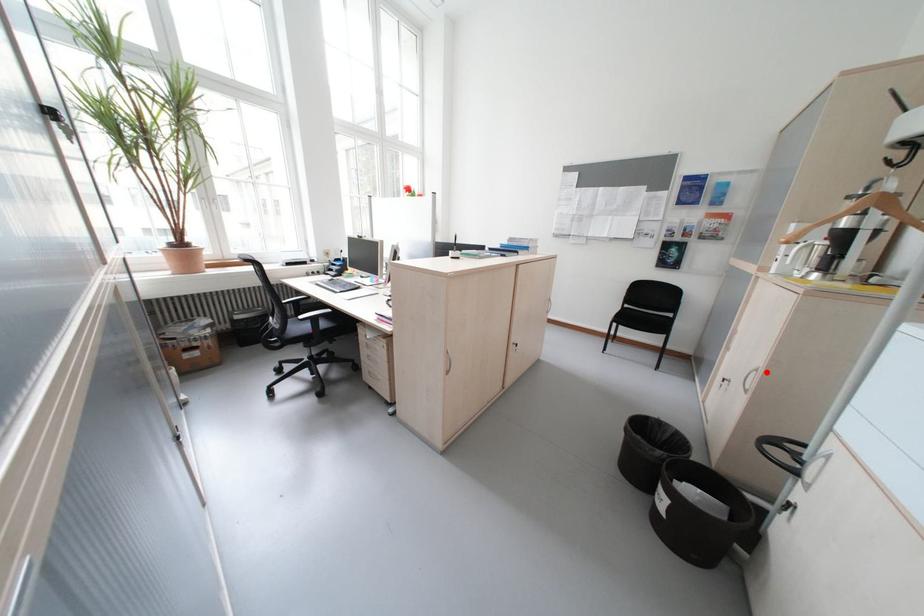
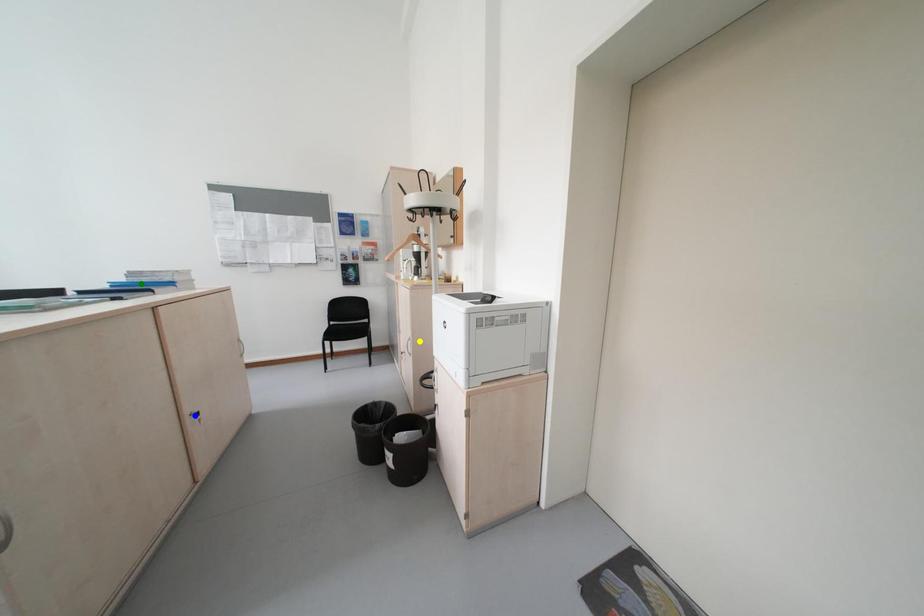
Question: I am providing you with two images of the same scene from different viewpoints. A red point is marked on the first image. You are given multiple points on the second image. Can you choose the point in image 2 that corresponds to the point in image 1?

Choices:
 (A) blue point
 (B) green point
 (C) yellow point

Answer: (C)